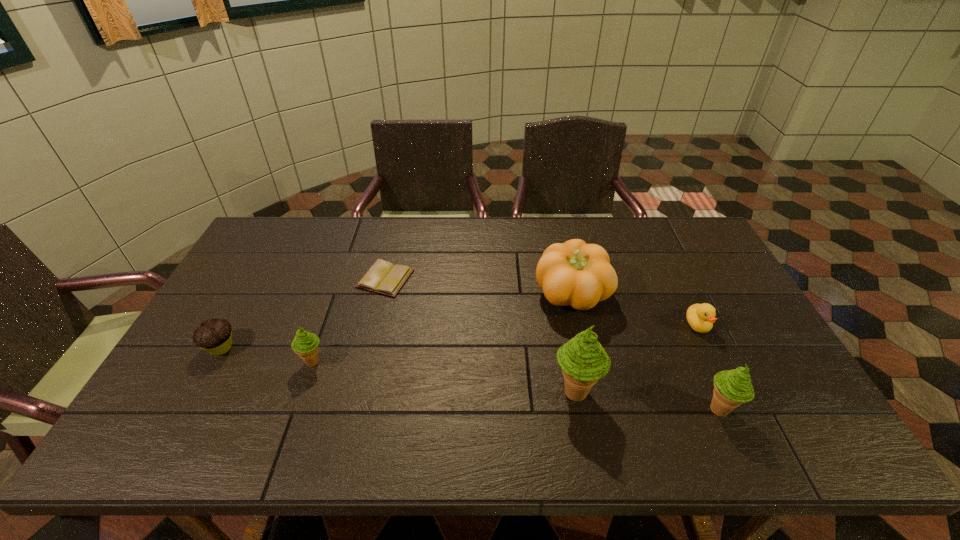
Identify the location of the leftmost icecream. The height and width of the screenshot is (540, 960). (305, 344).

Identify the location of the second object from left to right. (305, 344).

Locate an element on the screen. The height and width of the screenshot is (540, 960). the tallest icecream is located at coordinates (583, 360).

Find the location of a particular element. The height and width of the screenshot is (540, 960). the tallest object is located at coordinates (583, 360).

Where is `the rightmost icecream`? This screenshot has width=960, height=540. the rightmost icecream is located at coordinates (732, 388).

At what (x,y) coordinates should I click in order to perform the action: click on muffin. Please return your answer as a coordinate pair (x, y). The height and width of the screenshot is (540, 960). Looking at the image, I should click on coord(214,335).

At what (x,y) coordinates should I click in order to perform the action: click on pumpkin. Please return your answer as a coordinate pair (x, y). Looking at the image, I should click on (574, 273).

Locate an element on the screen. duckling is located at coordinates (700, 317).

You are a GUI agent. You are given a task and a screenshot of the screen. Output one action in this format:
    pyautogui.click(x=<x>, y=<y>)
    Task: Click on the third object from left to right
    This screenshot has height=540, width=960.
    Given the screenshot: What is the action you would take?
    pyautogui.click(x=383, y=277)

Locate an element on the screen. The image size is (960, 540). the shortest object is located at coordinates (383, 277).